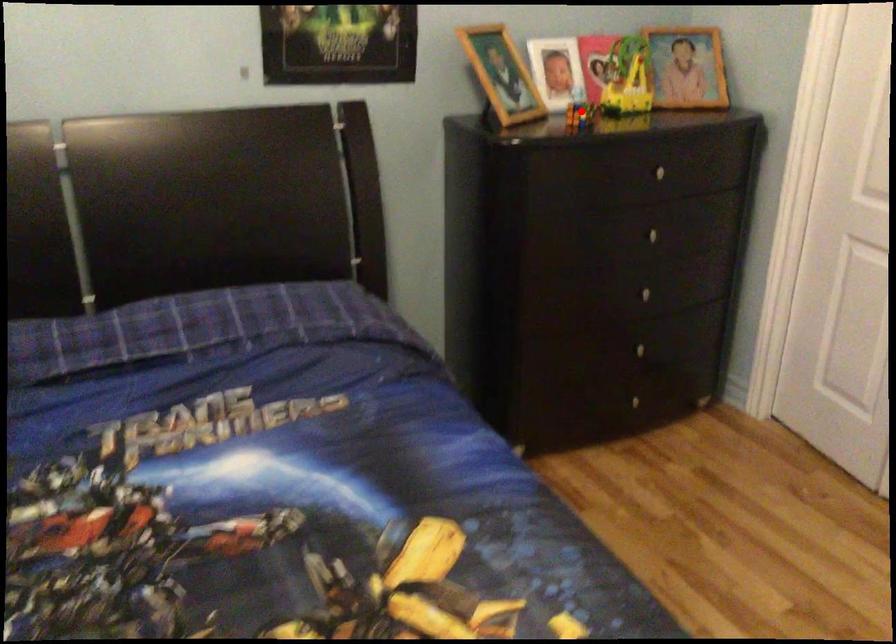
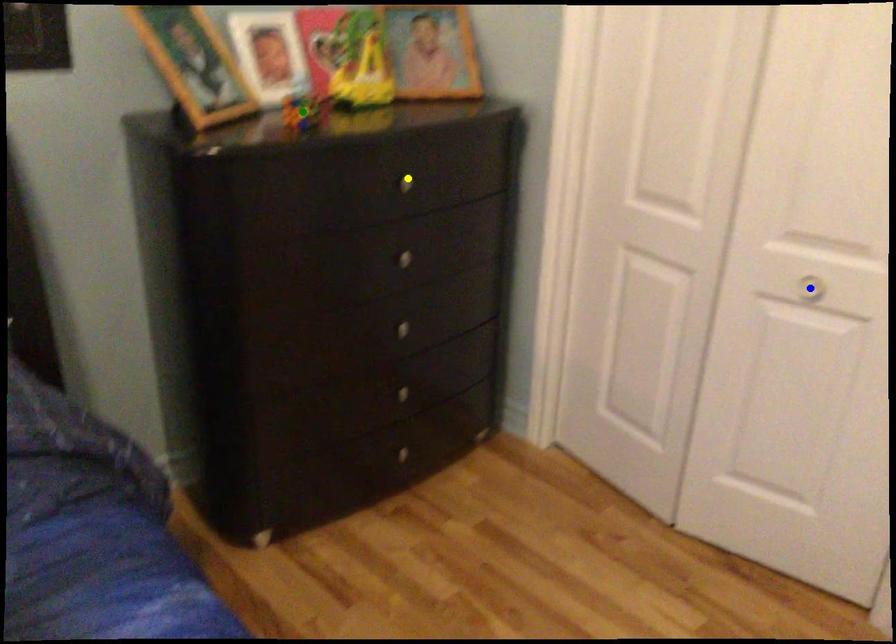
Question: I am providing you with two images of the same scene from different viewpoints. A red point is marked on the first image. You are given multiple points on the second image. In image 2, which mark is for the same physical point as the one in image 1?

Choices:
 (A) green point
 (B) blue point
 (C) yellow point

Answer: (A)